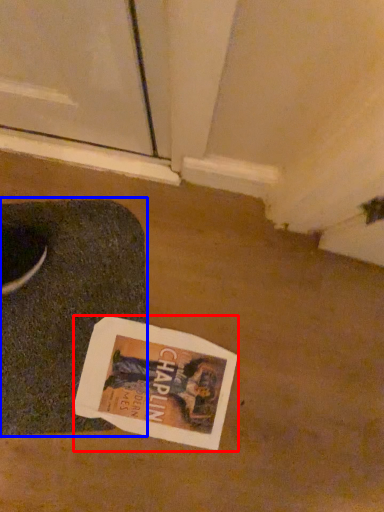
Question: Which object appears closest to the camera in this image, magazine (highlighted by a red box) or yoga mat (highlighted by a blue box)?

Choices:
 (A) magazine
 (B) yoga mat

Answer: (B)